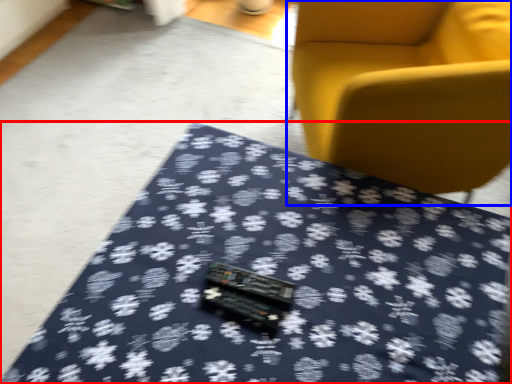
Question: Among these objects, which one is farthest to the camera, table (highlighted by a red box) or chair (highlighted by a blue box)?

Choices:
 (A) table
 (B) chair

Answer: (B)